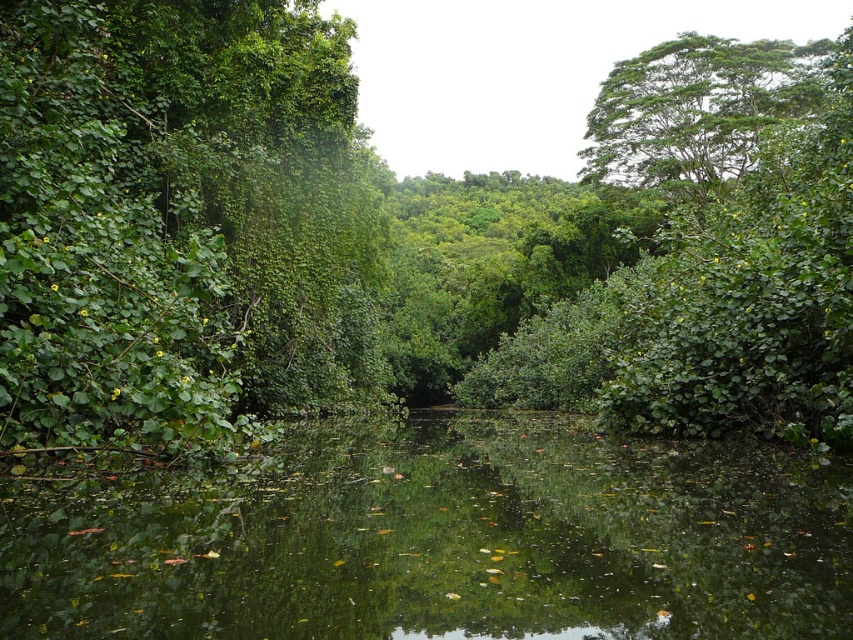
Question: Which point is farther to the camera?

Choices:
 (A) green leafy water at center
 (B) green leafy tree at left

Answer: (B)

Question: Does green leafy tree at left have a lesser width compared to green leafy tree at upper right?

Choices:
 (A) yes
 (B) no

Answer: (A)

Question: Does green leafy tree at left appear over green leafy water at center?

Choices:
 (A) yes
 (B) no

Answer: (A)

Question: Can you confirm if green leafy tree at left is smaller than green leafy water at center?

Choices:
 (A) no
 (B) yes

Answer: (A)

Question: Which object is positioned closest to the green leafy tree at upper right?

Choices:
 (A) green leafy water at center
 (B) green leafy tree at left

Answer: (B)

Question: Which object is closer to the camera taking this photo?

Choices:
 (A) green leafy tree at left
 (B) green leafy tree at upper right
 (C) green leafy water at center

Answer: (C)